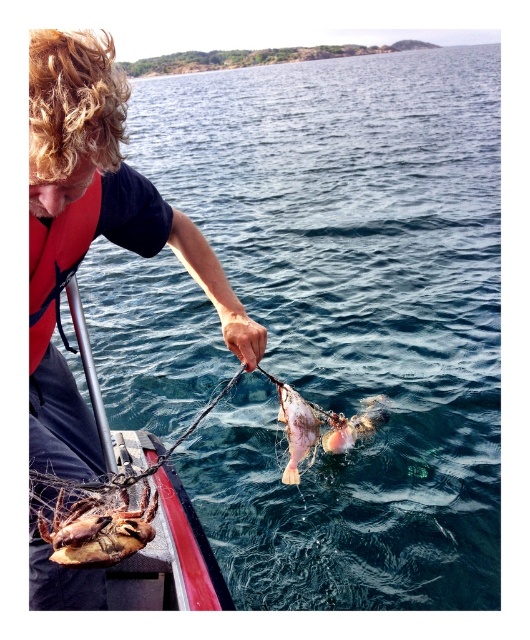
Question: Can you confirm if matte orange life vest at left is bigger than metallic silver crab at lower left?

Choices:
 (A) yes
 (B) no

Answer: (A)

Question: Can you confirm if matte orange life vest at left is positioned to the left of shiny silver fish at center?

Choices:
 (A) yes
 (B) no

Answer: (A)

Question: Which of the following is the closest to the observer?

Choices:
 (A) clear blue water at center
 (B) metallic silver crab at lower left
 (C) red life jacket at left
 (D) matte orange life vest at left

Answer: (D)

Question: Is shiny metallic crab at lower left above shiny silver fish at center?

Choices:
 (A) yes
 (B) no

Answer: (A)

Question: Which point is closer to the camera?

Choices:
 (A) shiny silver fish at center
 (B) metallic silver crab at lower left

Answer: (B)

Question: Which object is the farthest from the red life jacket at left?

Choices:
 (A) pink matte fish at center
 (B) metallic silver crab at lower left
 (C) matte orange life vest at left
 (D) clear blue water at center

Answer: (D)